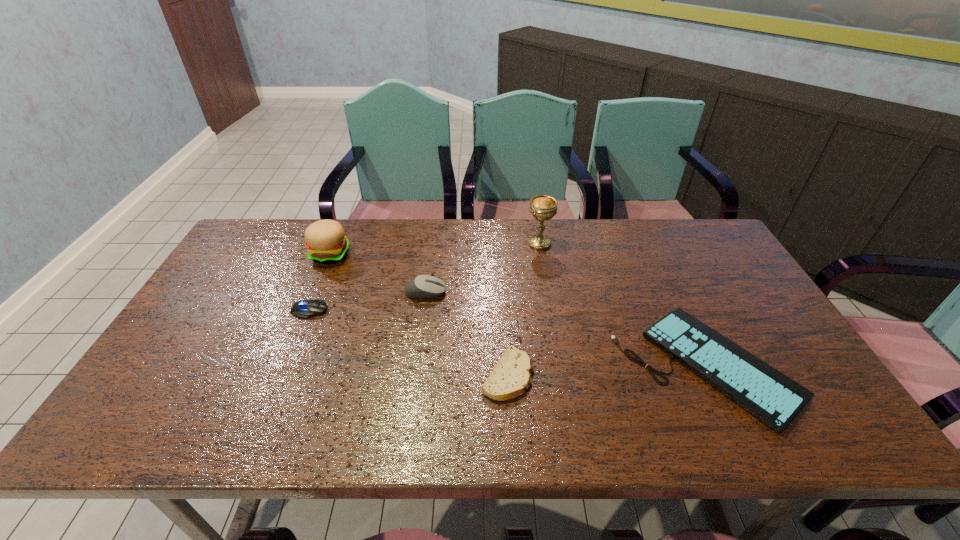
Locate an element on the screen. vacant space in between the computer keyboard and the third object from left to right is located at coordinates (565, 328).

This screenshot has width=960, height=540. I want to click on free space between the pita bread and the fifth shortest object, so click(x=420, y=315).

This screenshot has height=540, width=960. In order to click on vacant space in between the rightmost object and the left computer mouse in this screenshot , I will do `click(508, 337)`.

At what (x,y) coordinates should I click in order to perform the action: click on vacant space that's between the pita bread and the third object from left to right. Please return your answer as a coordinate pair (x, y). Looking at the image, I should click on (468, 333).

Locate an element on the screen. free space between the computer keyboard and the third object from right to left is located at coordinates (607, 369).

Locate an element on the screen. The image size is (960, 540). vacant space that is in between the rightmost object and the fourth object from left to right is located at coordinates (607, 369).

The image size is (960, 540). I want to click on object that stands as the second closest to the chalice, so click(x=422, y=286).

Where is `object that is the third closest one to the fourth object from left to right`? object that is the third closest one to the fourth object from left to right is located at coordinates (543, 207).

Locate an element on the screen. Image resolution: width=960 pixels, height=540 pixels. vacant space that satisfies the following two spatial constraints: 1. on the back side of the pita bread; 2. on the wheel side of the taller computer mouse is located at coordinates (503, 292).

I want to click on blank space that satisfies the following two spatial constraints: 1. on the back side of the fifth object from left to right; 2. on the left side of the hamburger, so click(335, 244).